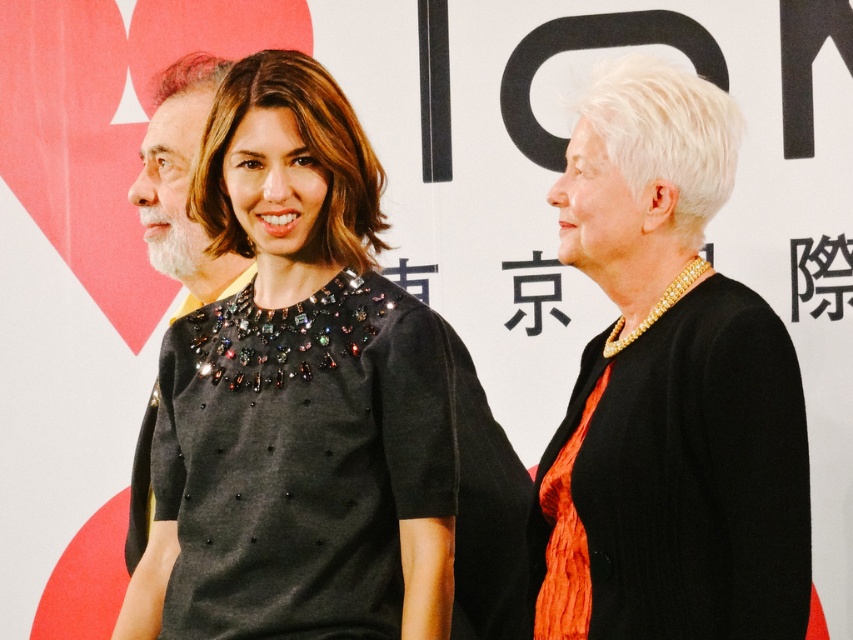
Question: Is black beaded dress at center further to the viewer compared to matte black dress at right?

Choices:
 (A) no
 (B) yes

Answer: (B)

Question: Can you confirm if black beaded dress at center is positioned to the right of gray textured hair at left?

Choices:
 (A) yes
 (B) no

Answer: (A)

Question: Estimate the real-world distances between objects in this image. Which object is farther from the matte black dress at right?

Choices:
 (A) black beaded dress at center
 (B) gray textured hair at left

Answer: (B)

Question: Can you confirm if black beaded dress at center is positioned below matte black dress at right?

Choices:
 (A) yes
 (B) no

Answer: (A)

Question: Which point appears closest to the camera in this image?

Choices:
 (A) (677, 356)
 (B) (161, 76)
 (C) (309, 216)

Answer: (A)

Question: Which point is closer to the camera?

Choices:
 (A) gray textured hair at left
 (B) matte black dress at right
 (C) black beaded dress at center

Answer: (B)